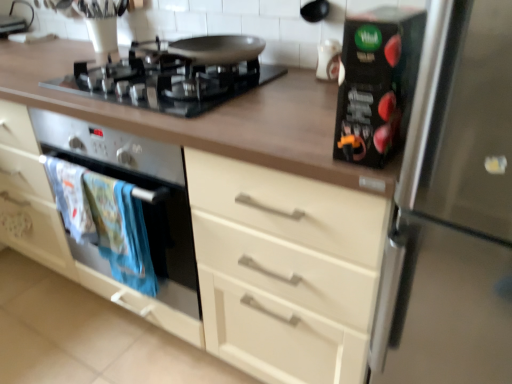
At what (x,y) coordinates should I click in order to perform the action: click on vacant area that is in front of white glossy vase at upper center, marked as the second appliance in a bottom-to-top arrangement. Please return your answer as a coordinate pair (x, y). The height and width of the screenshot is (384, 512). Looking at the image, I should click on (314, 91).